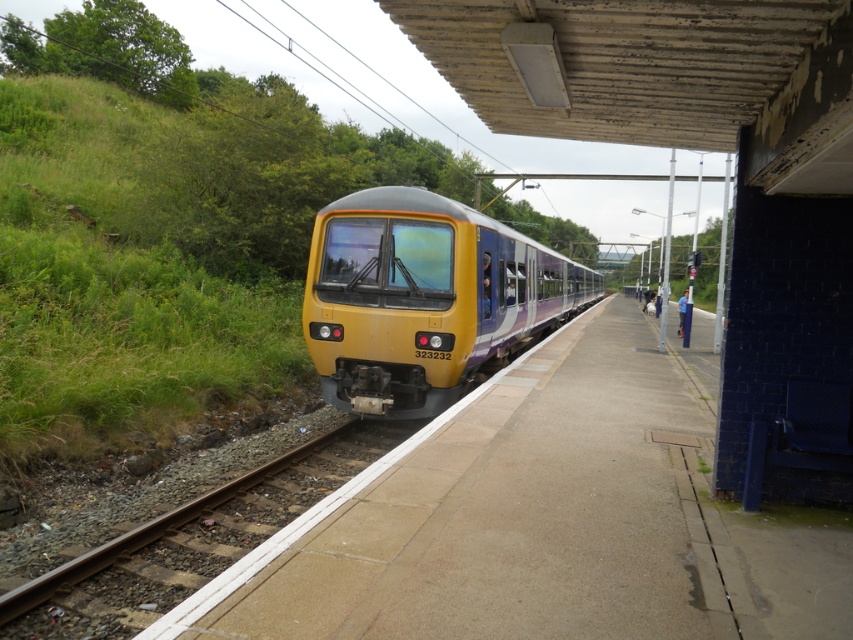
Question: In this image, where is yellow matte train at center located relative to brown gravel train track at lower left?

Choices:
 (A) above
 (B) below

Answer: (A)

Question: Does yellow matte train at center have a smaller size compared to brown gravel train track at lower left?

Choices:
 (A) yes
 (B) no

Answer: (B)

Question: Which point is farther to the camera?

Choices:
 (A) (357, 310)
 (B) (212, 528)

Answer: (A)

Question: Is yellow matte train at center smaller than brown gravel train track at lower left?

Choices:
 (A) no
 (B) yes

Answer: (A)

Question: Which point is closer to the camera taking this photo?

Choices:
 (A) (189, 593)
 (B) (405, 232)

Answer: (A)